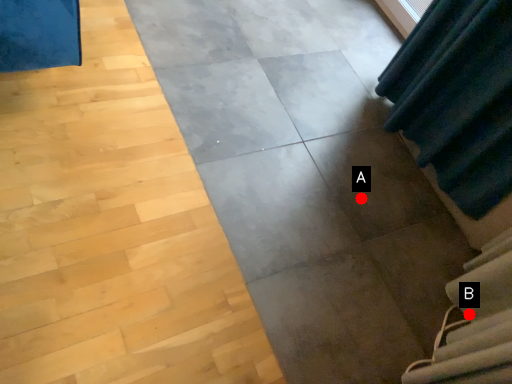
Question: Two points are circled on the image, labeled by A and B beside each circle. Which of the following is the farthest from the observer?

Choices:
 (A) A is further
 (B) B is further

Answer: (A)